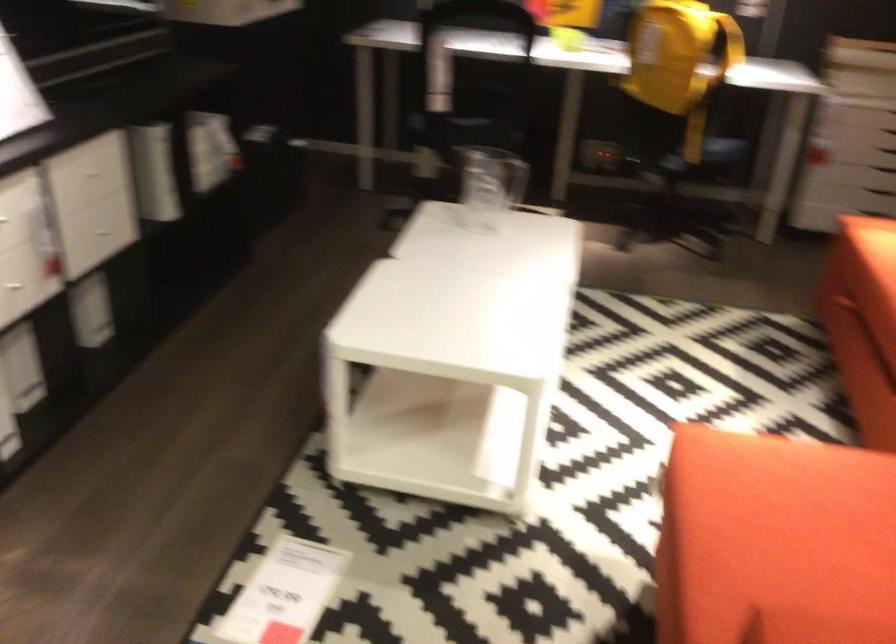
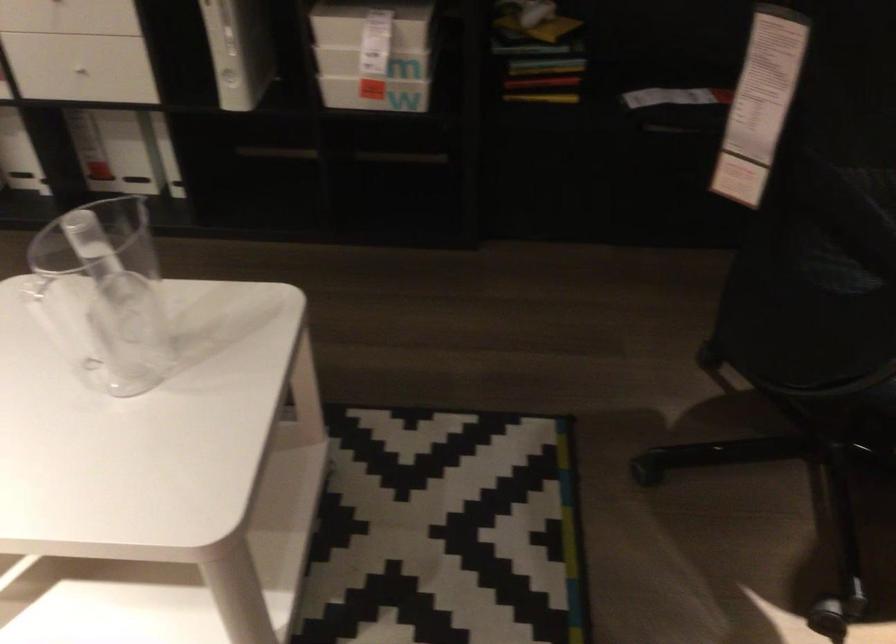
The point at (218, 176) is marked in the first image. Where is the corresponding point in the second image?

(375, 93)